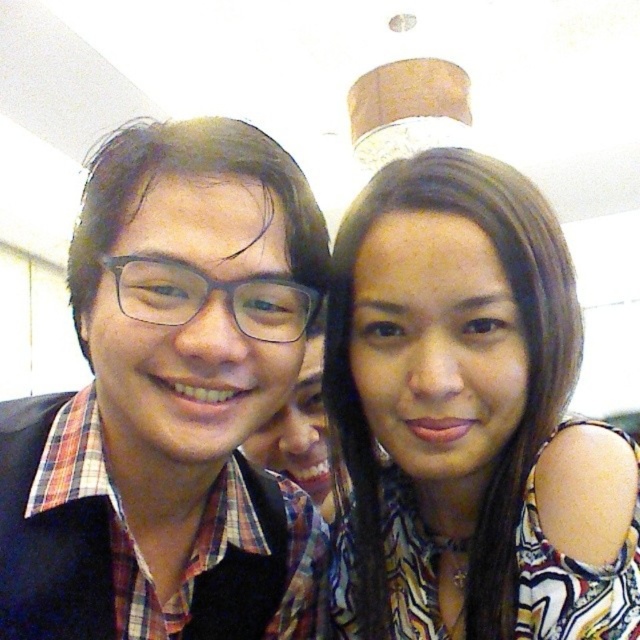
You are standing in the room where the photograph was taken. You want to touch the plaid fabric shirt at left. If you move straight toward the point at coordinates point (170, 403), will you reach the plaid fabric shirt at left?

Yes, because the point (170, 403) is where the plaid fabric shirt at left is located.

Based on the photo, you are a photographer setting up for a group photo. You notice the plaid fabric shirt at left and the multicolored printed blouse at center in the frame. Which clothing item should you adjust to ensure both are visible equally in the photo?

The plaid fabric shirt at left is taller than the multicolored printed blouse at center, so you should lower the plaid fabric shirt at left to balance their heights in the photo.